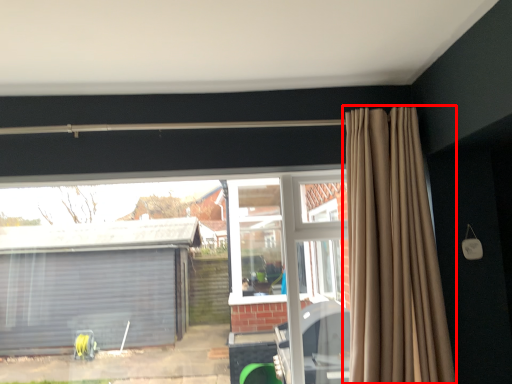
Question: Where is curtain (annotated by the red box) located in relation to window in the image?

Choices:
 (A) right
 (B) left

Answer: (A)